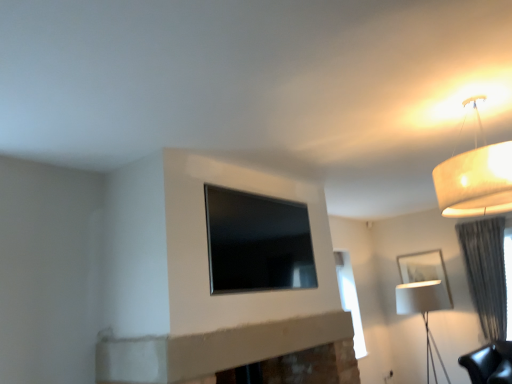
At what (x,y) coordinates should I click in order to perform the action: click on vacant space situated above black glass window at center (from a real-world perspective). Please return your answer as a coordinate pair (x, y). This screenshot has height=384, width=512. Looking at the image, I should click on (251, 193).